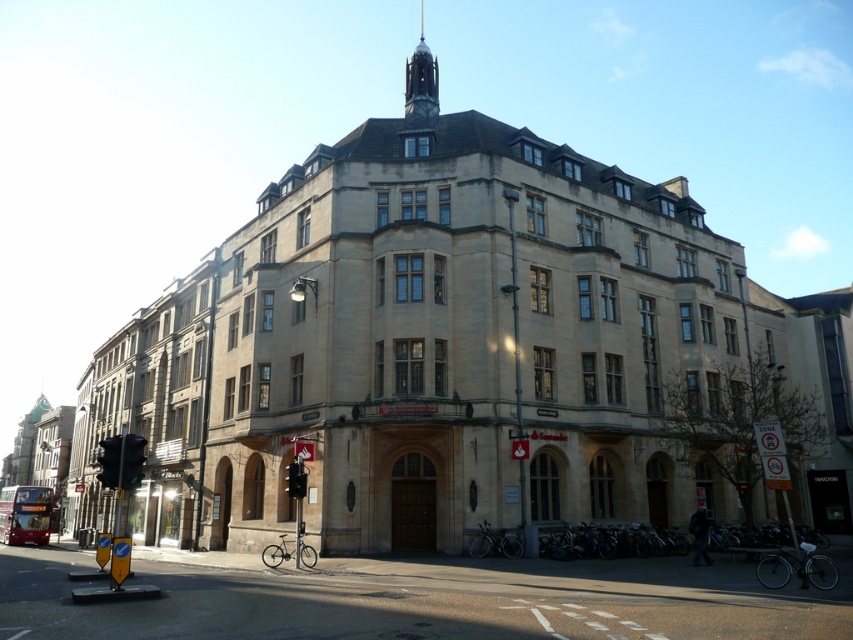
Question: Which of the following is the farthest from the observer?

Choices:
 (A) green glass traffic light at lower left
 (B) metallic rectangular traffic light at center
 (C) metallic traffic light at lower left

Answer: (B)

Question: Which object is the farthest from the metallic rectangular traffic light at center?

Choices:
 (A) green glass traffic light at lower left
 (B) metallic traffic light at lower left

Answer: (B)

Question: Can you confirm if metallic traffic light at lower left is positioned to the left of metallic rectangular traffic light at center?

Choices:
 (A) yes
 (B) no

Answer: (A)

Question: Which object appears closest to the camera in this image?

Choices:
 (A) metallic rectangular traffic light at center
 (B) green glass traffic light at lower left

Answer: (B)

Question: Is green glass traffic light at lower left to the right of metallic traffic light at lower left from the viewer's perspective?

Choices:
 (A) yes
 (B) no

Answer: (A)

Question: Is metallic traffic light at lower left to the left of metallic rectangular traffic light at center from the viewer's perspective?

Choices:
 (A) no
 (B) yes

Answer: (B)